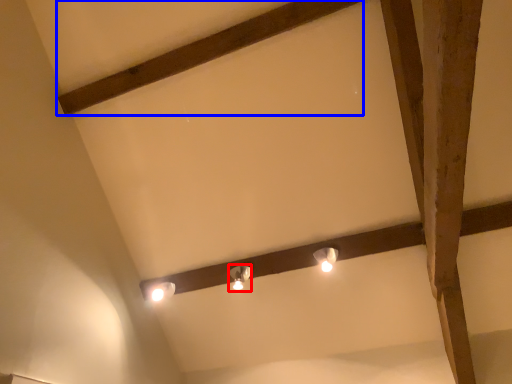
Question: Which of the following is the farthest to the observer, lamp (highlighted by a red box) or plank (highlighted by a blue box)?

Choices:
 (A) lamp
 (B) plank

Answer: (A)